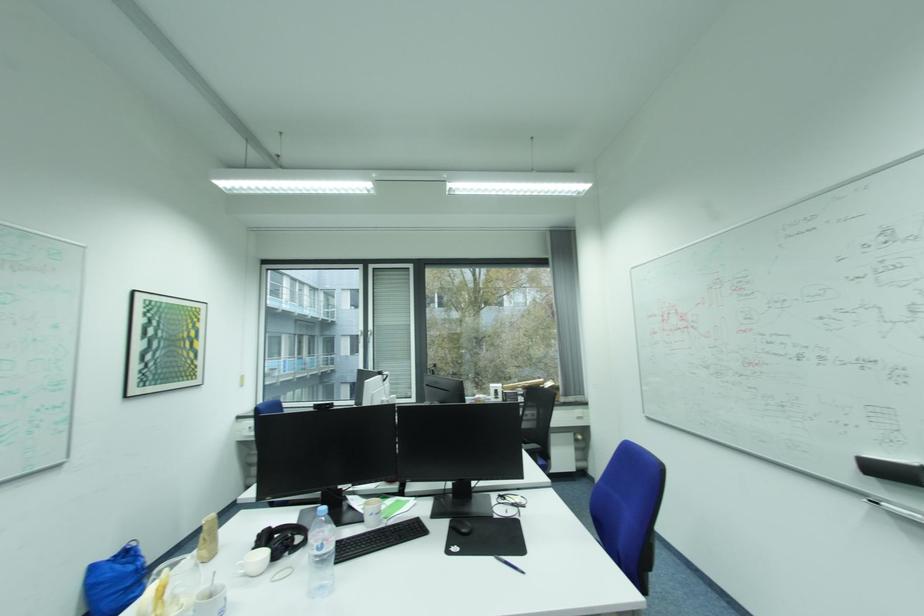
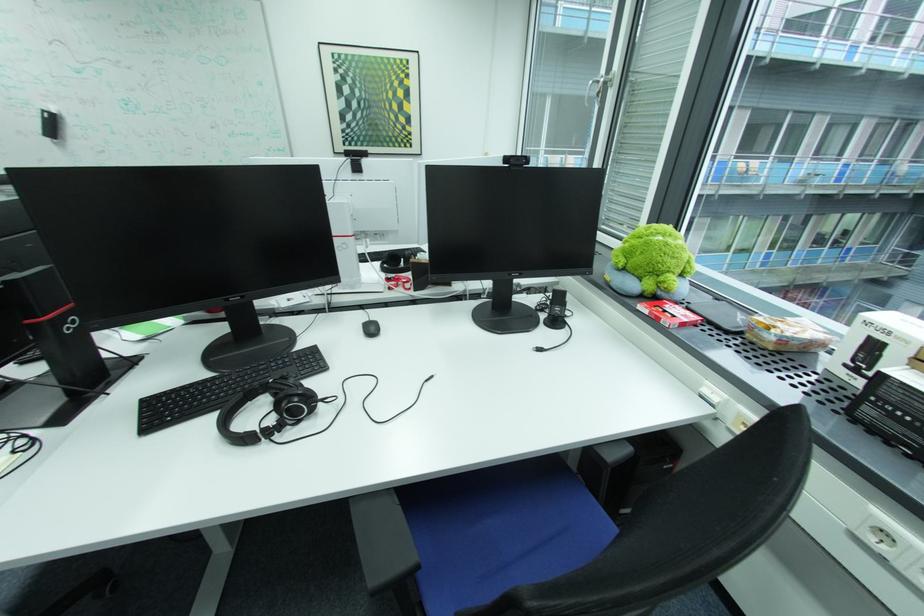
Where in the second image is the point corresponding to point (492, 399) from the first image?

(781, 339)